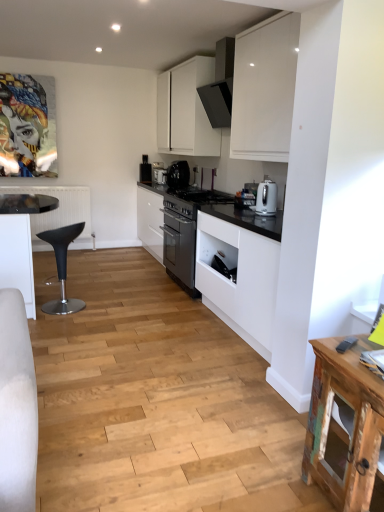
Question: Should I look upward or downward to see satin silver kettle at right, the 1th kitchen appliance from the right?

Choices:
 (A) up
 (B) down

Answer: (A)

Question: Can you confirm if white glossy coffee maker at center, placed as the 1th kitchen appliance when sorted from back to front, is taller than satin black coffee maker at center, positioned as the 2th kitchen appliance in left-to-right order?

Choices:
 (A) no
 (B) yes

Answer: (A)

Question: Is white glossy coffee maker at center, positioned as the first kitchen appliance in top-to-bottom order, wider than satin black coffee maker at center, the 2th kitchen appliance positioned from the back?

Choices:
 (A) yes
 (B) no

Answer: (B)

Question: Can you confirm if white glossy coffee maker at center, positioned as the first kitchen appliance in top-to-bottom order, is positioned to the right of satin black coffee maker at center, the 2th kitchen appliance from the right?

Choices:
 (A) no
 (B) yes

Answer: (A)

Question: From a real-world perspective, is white glossy coffee maker at center, acting as the 3th kitchen appliance starting from the bottom, over satin black coffee maker at center, the second kitchen appliance positioned from the bottom?

Choices:
 (A) no
 (B) yes

Answer: (A)

Question: Is white glossy coffee maker at center, the 3th kitchen appliance in the right-to-left sequence, to the left of satin black coffee maker at center, positioned as the 2th kitchen appliance in left-to-right order, from the viewer's perspective?

Choices:
 (A) yes
 (B) no

Answer: (A)

Question: Can you confirm if white glossy coffee maker at center, the 3th kitchen appliance in the right-to-left sequence, is thinner than satin black coffee maker at center, positioned as the 2th kitchen appliance in left-to-right order?

Choices:
 (A) yes
 (B) no

Answer: (A)

Question: From the image's perspective, is white matte cabinet at upper center below black matte toaster at upper center?

Choices:
 (A) no
 (B) yes

Answer: (A)

Question: Is white matte cabinet at upper center at the right side of black matte toaster at upper center?

Choices:
 (A) no
 (B) yes

Answer: (B)

Question: Considering the relative sizes of white matte cabinet at upper center and black matte toaster at upper center in the image provided, is white matte cabinet at upper center taller than black matte toaster at upper center?

Choices:
 (A) no
 (B) yes

Answer: (B)

Question: Is white matte cabinet at upper center shorter than black matte toaster at upper center?

Choices:
 (A) no
 (B) yes

Answer: (A)

Question: Would you consider white matte cabinet at upper center to be distant from black matte toaster at upper center?

Choices:
 (A) yes
 (B) no

Answer: (B)

Question: Can you confirm if white matte cabinet at upper center is positioned to the left of black matte toaster at upper center?

Choices:
 (A) yes
 (B) no

Answer: (B)

Question: From a real-world perspective, is white glossy coffee maker at center, the 3th kitchen appliance in the right-to-left sequence, physically above satin silver kettle at right, the 1th kitchen appliance from the right?

Choices:
 (A) yes
 (B) no

Answer: (B)